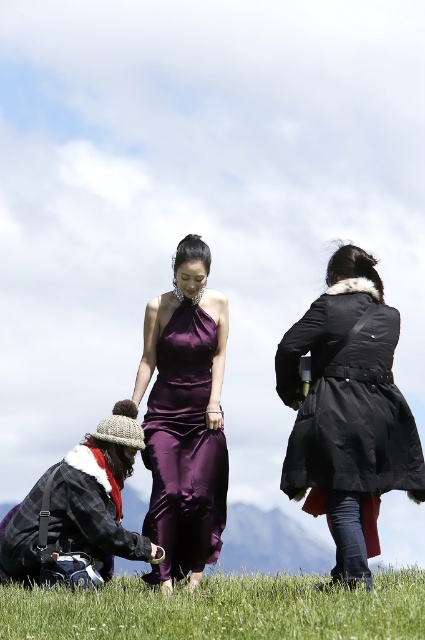
Question: Which of the following is the closest to the observer?

Choices:
 (A) satin purple dress at center
 (B) green grass at lower center
 (C) black matte coat at center

Answer: (B)

Question: Is green grass at lower center to the right of satin purple dress at center from the viewer's perspective?

Choices:
 (A) yes
 (B) no

Answer: (A)

Question: Which is farther from the black matte coat at center?

Choices:
 (A) satin purple dress at center
 (B) green grass at lower center

Answer: (A)

Question: Does green grass at lower center have a smaller size compared to black matte coat at center?

Choices:
 (A) no
 (B) yes

Answer: (A)

Question: Which point is closer to the camera?

Choices:
 (A) black matte coat at center
 (B) green grass at lower center

Answer: (B)

Question: Is black matte coat at center bigger than satin purple dress at center?

Choices:
 (A) yes
 (B) no

Answer: (B)